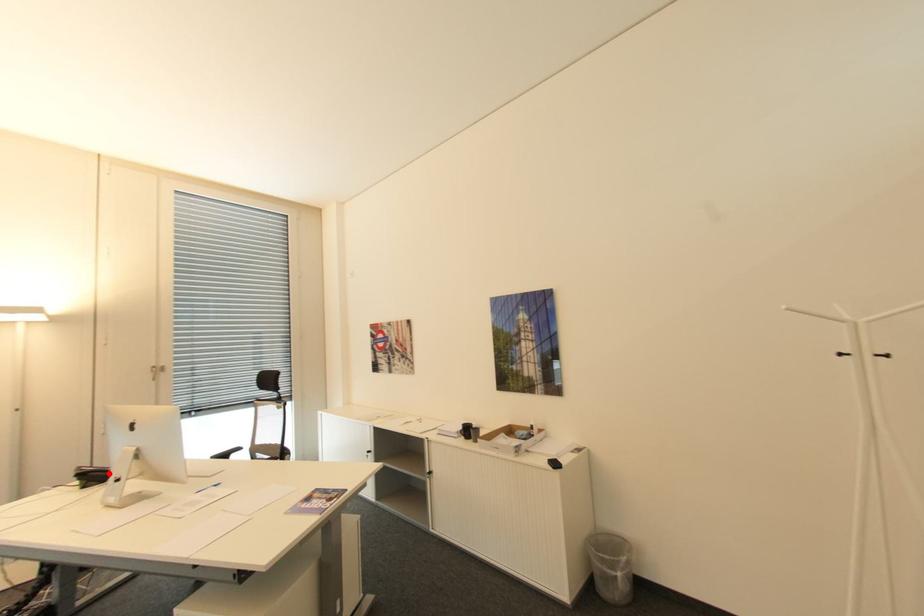
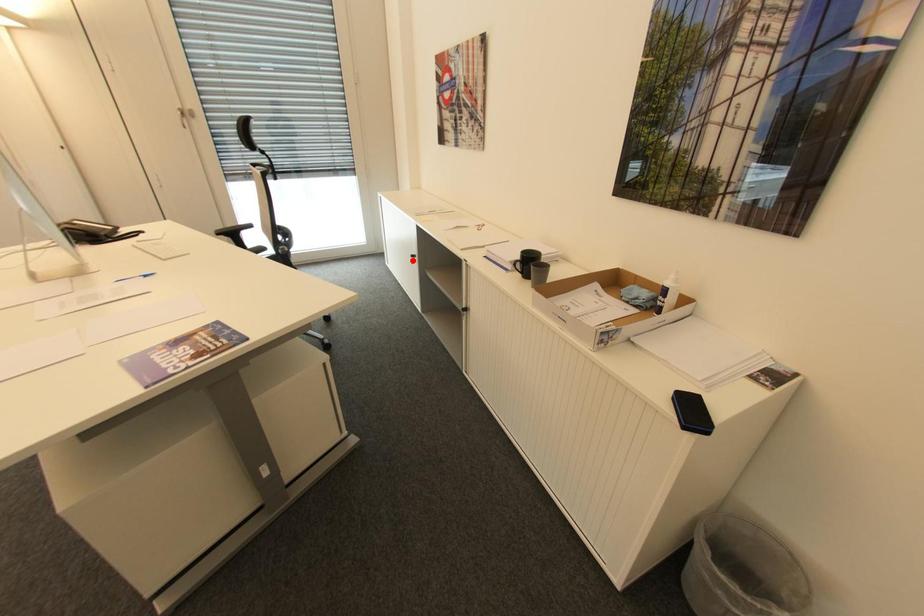
I am providing you with two images of the same scene from different viewpoints. A red point is marked on the first image and another point is marked on the second image. Is the marked point in image1 the same physical position as the marked point in image2?

No